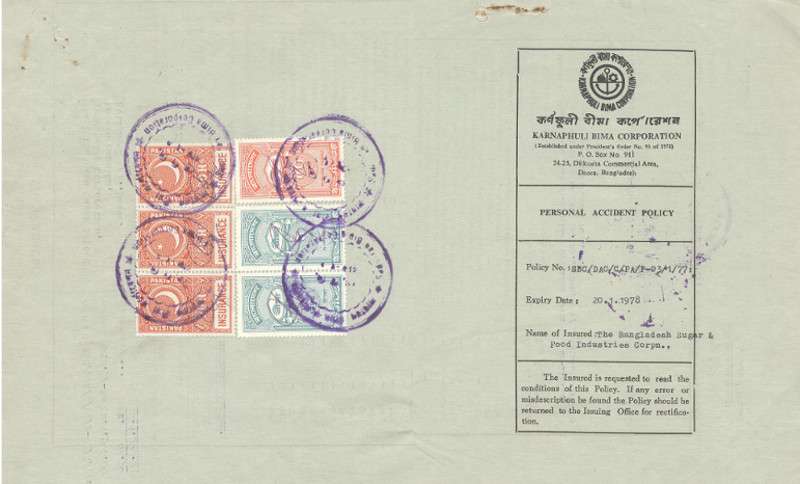
Where is `stains`? stains is located at coordinates [x=530, y=10], [x=28, y=56].